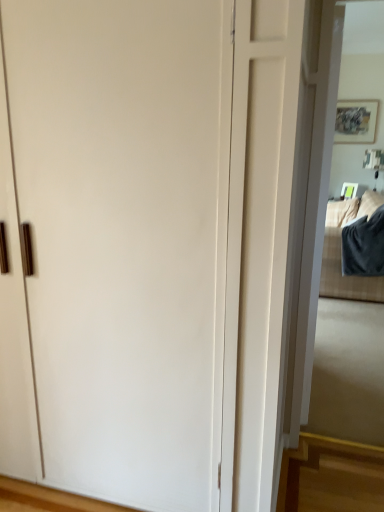
Question: In terms of height, does white glossy mirror at right look taller or shorter compared to dark gray plush blanket at right?

Choices:
 (A) short
 (B) tall

Answer: (B)

Question: Visually, is white glossy mirror at right positioned to the left or to the right of dark gray plush blanket at right?

Choices:
 (A) left
 (B) right

Answer: (A)

Question: From a real-world perspective, is white glossy mirror at right positioned above or below dark gray plush blanket at right?

Choices:
 (A) below
 (B) above

Answer: (B)

Question: In terms of width, does dark gray plush blanket at right look wider or thinner when compared to white glossy mirror at right?

Choices:
 (A) thin
 (B) wide

Answer: (B)

Question: Does point (324, 242) appear closer or farther from the camera than point (349, 158)?

Choices:
 (A) closer
 (B) farther

Answer: (A)

Question: Is dark gray plush blanket at right in front of or behind white glossy mirror at right in the image?

Choices:
 (A) behind
 (B) front

Answer: (A)

Question: From the image's perspective, is dark gray plush blanket at right positioned above or below white glossy mirror at right?

Choices:
 (A) above
 (B) below

Answer: (A)